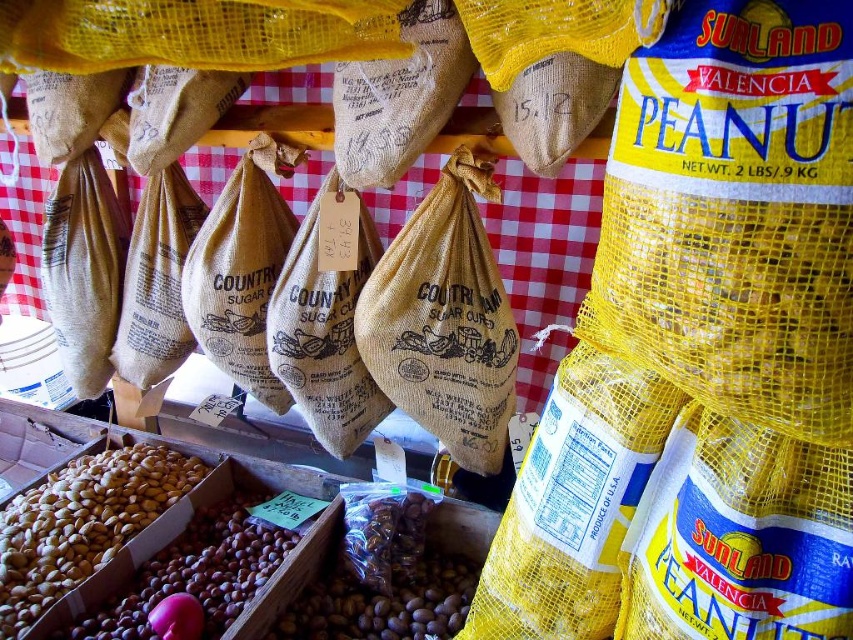
You are a customer at the market and want to pick up the brown matte nuts at lower left and the brown matte nuts at center. Which one is easier to reach without moving your position?

The brown matte nuts at lower left is closer to the viewer, so it is easier to reach without moving your position.

You are standing in front of the display and want to touch both points mentioned. Which point should you reach for first, the point at coordinate (190, 476) or the point at (263, 529)?

You should reach for point (190, 476) first because it is closer to you than point (263, 529), which is further away.